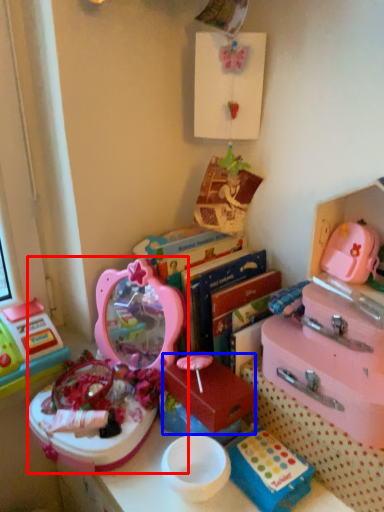
Question: Among these objects, which one is farthest to the camera, toy (highlighted by a red box) or storage box (highlighted by a blue box)?

Choices:
 (A) toy
 (B) storage box

Answer: (B)